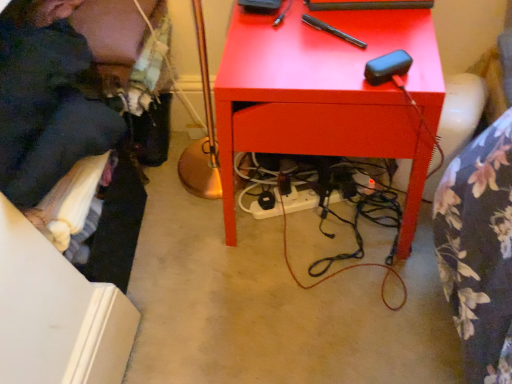
Question: Looking at the image, does matte red desk at center seem bigger or smaller compared to dark blue fabric at left?

Choices:
 (A) small
 (B) big

Answer: (B)

Question: Is point (267, 145) closer or farther from the camera than point (1, 29)?

Choices:
 (A) farther
 (B) closer

Answer: (A)

Question: From the image's perspective, is matte red desk at center located above or below dark blue fabric at left?

Choices:
 (A) above
 (B) below

Answer: (B)

Question: Visually, is dark blue fabric at left positioned to the left or to the right of matte red desk at center?

Choices:
 (A) right
 (B) left

Answer: (B)

Question: Does point (40, 109) appear closer or farther from the camera than point (339, 59)?

Choices:
 (A) closer
 (B) farther

Answer: (A)

Question: Looking at the image, does dark blue fabric at left seem bigger or smaller compared to matte red desk at center?

Choices:
 (A) big
 (B) small

Answer: (B)

Question: Is dark blue fabric at left wider or thinner than matte red desk at center?

Choices:
 (A) thin
 (B) wide

Answer: (A)